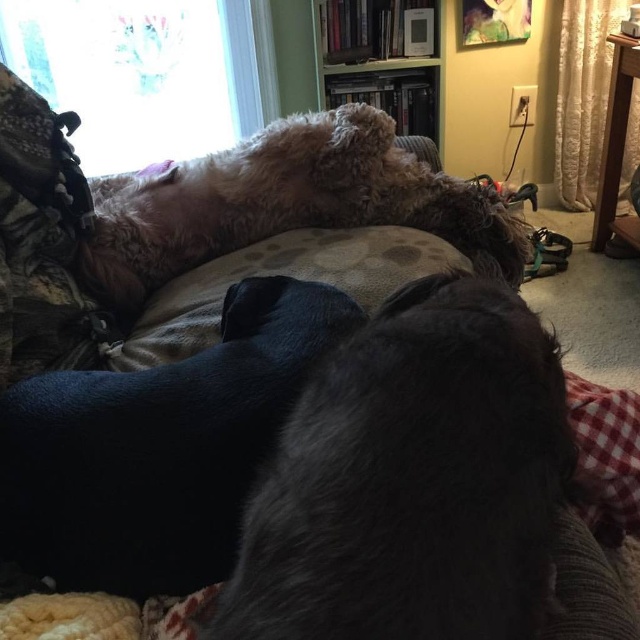
You are a photographer standing in front of the couch with two dogs. You want to take a closeup photo of the shiny black fur at center. If your camera can focus on objects within 50 centimeters, will you need to move closer or farther away?

The distance between the shiny black fur at center and the camera is 66.07 centimeters. Since the camera can focus within 50 centimeters, you need to move closer to get a clear focus.